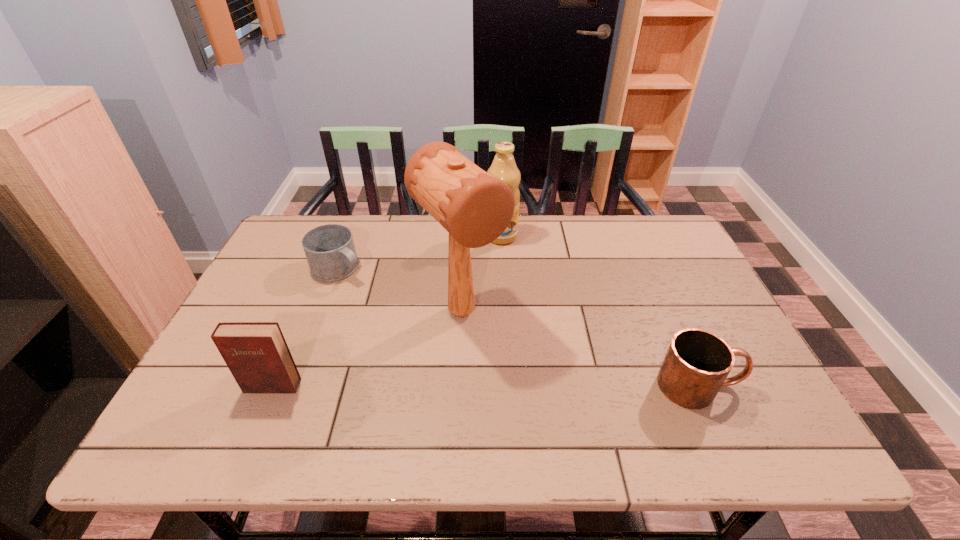
Identify the location of free space located on the side of the left mug with the handle. coord(456,347).

I want to click on free space located on the side of the left mug with the handle, so click(400, 309).

Where is `free space located on the side of the left mug with the handle`? Image resolution: width=960 pixels, height=540 pixels. free space located on the side of the left mug with the handle is located at coordinates (413, 318).

This screenshot has width=960, height=540. What are the coordinates of `vacant space located on the strike surface of the tallest object` in the screenshot? It's located at (533, 397).

Image resolution: width=960 pixels, height=540 pixels. What are the coordinates of `free spot located on the strike surface of the tallest object` in the screenshot? It's located at (501, 360).

Where is `free spot located on the strike surface of the tallest object`? This screenshot has height=540, width=960. free spot located on the strike surface of the tallest object is located at coordinates (524, 387).

This screenshot has width=960, height=540. I want to click on olive oil that is at the far edge, so pyautogui.click(x=503, y=167).

You are a GUI agent. You are given a task and a screenshot of the screen. Output one action in this format:
    pyautogui.click(x=<x>, y=<y>)
    Task: Click on the mug present at the far edge
    The image size is (960, 540).
    Given the screenshot: What is the action you would take?
    pyautogui.click(x=330, y=251)

The image size is (960, 540). I want to click on diary that is positioned at the near edge, so click(256, 353).

What are the coordinates of `mug at the near edge` in the screenshot? It's located at (697, 363).